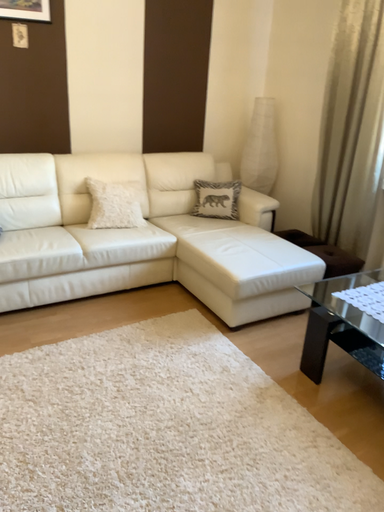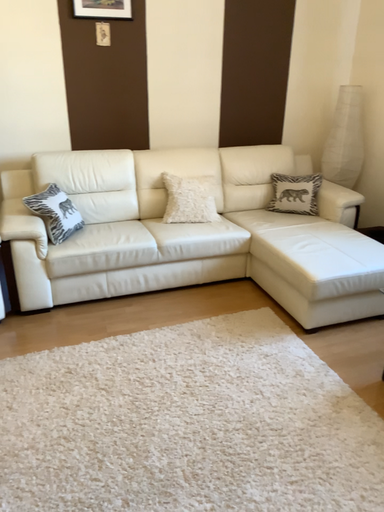
Question: Which way did the camera rotate in the video?

Choices:
 (A) rotated left
 (B) rotated right

Answer: (A)